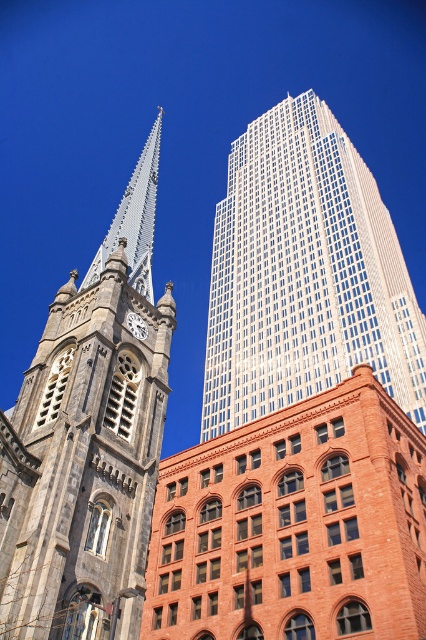
Question: Which of the following is the closest to the observer?

Choices:
 (A) (313, 385)
 (B) (92, 444)
 (C) (155, 208)

Answer: (B)

Question: From the image, what is the correct spatial relationship of white glass skyscraper at upper center in relation to matte gray clock at center?

Choices:
 (A) above
 (B) below

Answer: (A)

Question: Which object is positioned farthest from the silver metallic spire at upper left?

Choices:
 (A) matte gray clock at center
 (B) white glass skyscraper at upper center
 (C) gray stone tower at left

Answer: (B)

Question: Which of the following is the farthest from the observer?

Choices:
 (A) (143, 241)
 (B) (169, 300)

Answer: (A)

Question: Does white glass skyscraper at upper center lie behind matte gray clock at center?

Choices:
 (A) no
 (B) yes

Answer: (B)

Question: Does gray stone tower at left have a larger size compared to matte gray clock at center?

Choices:
 (A) yes
 (B) no

Answer: (A)